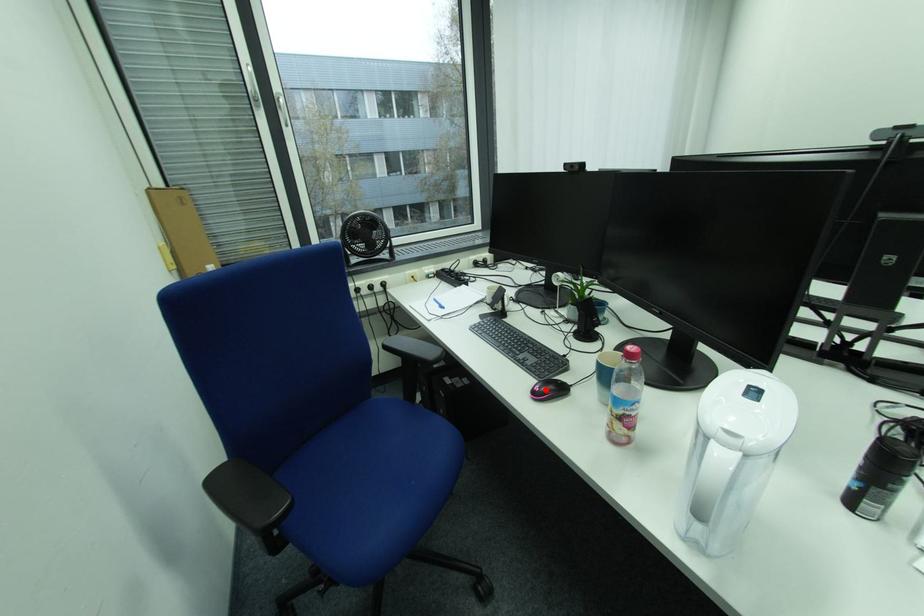
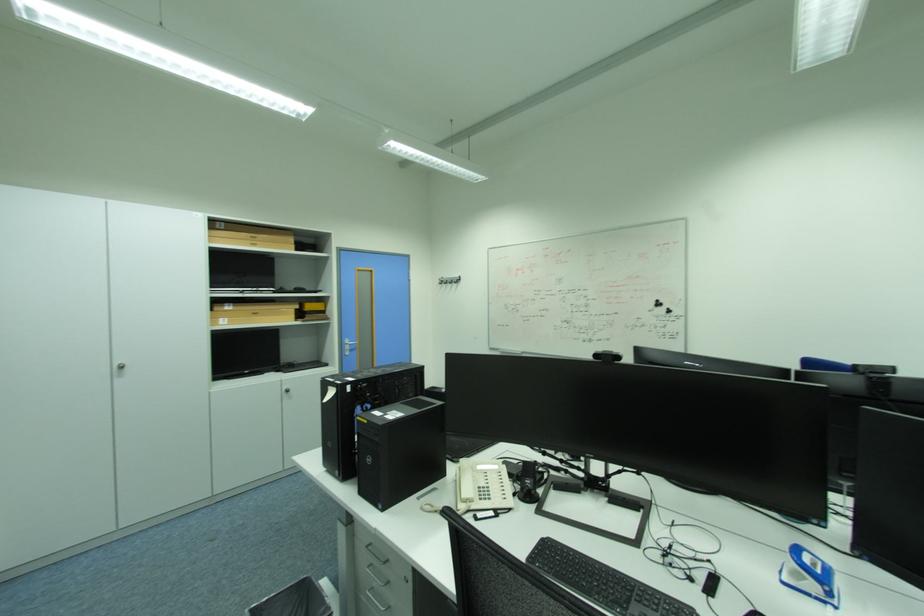
Question: I am providing you with two images of the same scene from different viewpoints. A red point is marked on the first image. At the location where the point appears in image 1, is it still visible in image 2?

Choices:
 (A) Yes
 (B) No

Answer: (B)